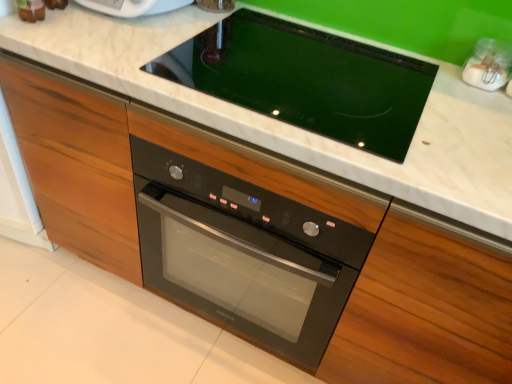
This screenshot has width=512, height=384. Describe the element at coordinates (294, 126) in the screenshot. I see `white marble countertop at center` at that location.

What do you see at coordinates (244, 254) in the screenshot? I see `black glass oven at center` at bounding box center [244, 254].

The height and width of the screenshot is (384, 512). Identify the location of black glass cooktop at center. (306, 80).

Is black glass oven at center inside or outside of white marble countertop at center?

black glass oven at center lies within the bounds of white marble countertop at center.

Is black glass oven at center far from white marble countertop at center?

No, black glass oven at center is not far from white marble countertop at center.

Is black glass oven at center bigger or smaller than white marble countertop at center?

In the image, black glass oven at center appears to be smaller than white marble countertop at center.

How different are the orientations of black glass oven at center and black glass cooktop at center in degrees?

They differ by 0.000233 degrees in their facing directions.

Image resolution: width=512 pixels, height=384 pixels. Identify the location of home appliance in front of the black glass oven at center. (306, 80).

Is black glass oven at center taller than black glass cooktop at center?

Correct, black glass oven at center is much taller as black glass cooktop at center.

Which point is more distant from viewer, (x=224, y=272) or (x=257, y=50)?

The point (x=224, y=272) is farther.

Identify the location of home appliance located above the white marble countertop at center (from the image's perspective). The height and width of the screenshot is (384, 512). (306, 80).

Which is closer, (288,117) or (424,165)?

The point (424,165) is closer to the camera.

Which object is thinner, black glass cooktop at center or white marble countertop at center?

black glass cooktop at center.

Can you confirm if black glass cooktop at center is smaller than white marble countertop at center?

Yes, black glass cooktop at center is smaller than white marble countertop at center.

Who is more distant, black glass cooktop at center or black glass oven at center?

black glass oven at center.

Considering the points (357, 54) and (188, 278), which point is behind, point (357, 54) or point (188, 278)?

The point (188, 278) is behind.

Are black glass cooktop at center and black glass oven at center far apart?

No, there isn't a large distance between black glass cooktop at center and black glass oven at center.

Is black glass cooktop at center at the left side of black glass oven at center?

In fact, black glass cooktop at center is to the right of black glass oven at center.

Is the position of white marble countertop at center more distant than that of black glass cooktop at center?

No, the depth of white marble countertop at center is less than that of black glass cooktop at center.

Considering the sizes of white marble countertop at center and black glass cooktop at center in the image, is white marble countertop at center taller or shorter than black glass cooktop at center?

Considering their sizes, white marble countertop at center has more height than black glass cooktop at center.

Find the location of a particular element. The width and height of the screenshot is (512, 384). home appliance located on the left of white marble countertop at center is located at coordinates (306, 80).

Considering the relative positions of white marble countertop at center and black glass cooktop at center in the image provided, is white marble countertop at center to the left of black glass cooktop at center from the viewer's perspective?

No.

Is white marble countertop at center thinner than black glass oven at center?

Indeed, white marble countertop at center has a lesser width compared to black glass oven at center.

From their relative heights in the image, would you say white marble countertop at center is taller or shorter than black glass oven at center?

white marble countertop at center is taller than black glass oven at center.

You are a GUI agent. You are given a task and a screenshot of the screen. Output one action in this format:
    pyautogui.click(x=<x>, y=<y>)
    Task: Click on the oven lying below the white marble countertop at center (from the image's perspective)
    The image size is (512, 384).
    Given the screenshot: What is the action you would take?
    pyautogui.click(x=244, y=254)

Find the location of a particular element. countertop in front of the black glass oven at center is located at coordinates (294, 126).

Identify the location of oven that is behind the black glass cooktop at center. (244, 254).

Looking at this image, when comparing their distances from white marble countertop at center, does black glass cooktop at center or black glass oven at center seem closer?

black glass cooktop at center is closer to white marble countertop at center.

Estimate the real-world distances between objects in this image. Which object is closer to black glass cooktop at center, white marble countertop at center or black glass oven at center?

Among the two, white marble countertop at center is located nearer to black glass cooktop at center.

Based on their spatial positions, is black glass cooktop at center or white marble countertop at center closer to black glass oven at center?

The object closer to black glass oven at center is white marble countertop at center.

When comparing their distances from black glass oven at center, does white marble countertop at center or black glass cooktop at center seem further?

black glass cooktop at center is further to black glass oven at center.

From the image, which object appears to be farther from white marble countertop at center, black glass oven at center or black glass cooktop at center?

black glass oven at center is positioned further to the anchor white marble countertop at center.

Based on their spatial positions, is black glass oven at center or white marble countertop at center further from black glass cooktop at center?

The object further to black glass cooktop at center is black glass oven at center.

Find the location of a particular element. This screenshot has height=384, width=512. countertop between black glass cooktop at center and black glass oven at center from top to bottom is located at coordinates (294, 126).